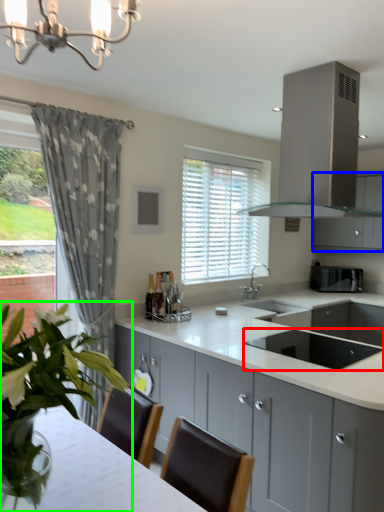
Question: Which is farther away from appliance (highlighted by a red box)? cabinetry (highlighted by a blue box) or houseplant (highlighted by a green box)?

Choices:
 (A) cabinetry
 (B) houseplant

Answer: (A)